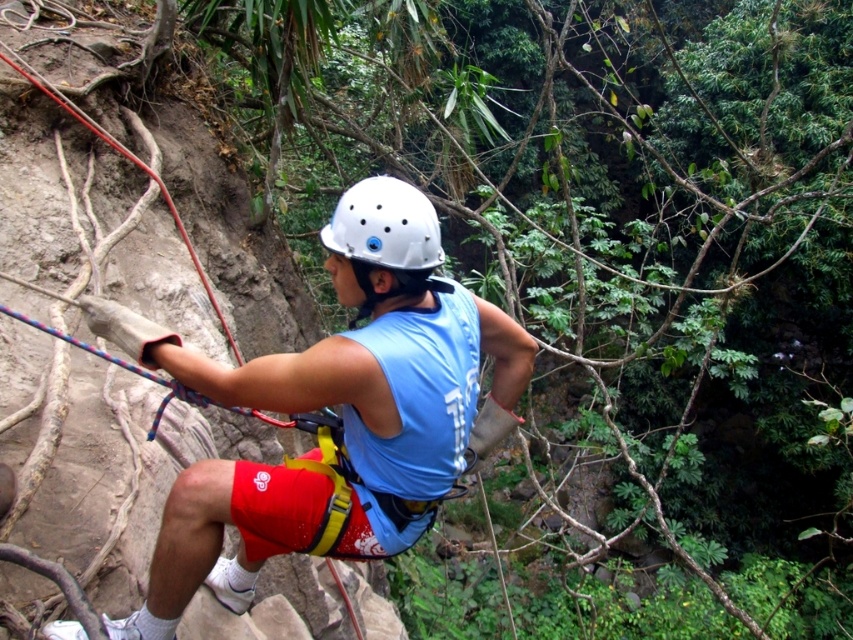
Question: Considering the relative positions of matte blue tank top at center and white matte helmet at center in the image provided, where is matte blue tank top at center located with respect to white matte helmet at center?

Choices:
 (A) above
 (B) below

Answer: (B)

Question: In this image, where is matte blue tank top at center located relative to white matte helmet at center?

Choices:
 (A) right
 (B) left

Answer: (B)

Question: Is matte blue tank top at center to the left of white matte helmet at center from the viewer's perspective?

Choices:
 (A) no
 (B) yes

Answer: (B)

Question: Which object is closer to the camera taking this photo?

Choices:
 (A) matte blue tank top at center
 (B) white matte helmet at center

Answer: (A)

Question: Which of the following is the closest to the observer?

Choices:
 (A) matte blue tank top at center
 (B) white matte helmet at center

Answer: (A)